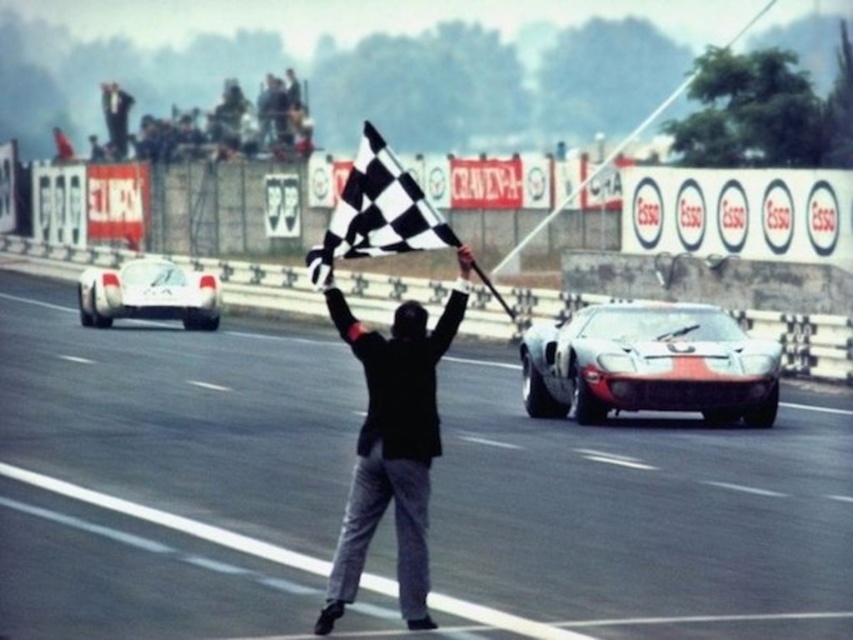
Is point (469, 506) closer to camera compared to point (340, 243)?

No, (469, 506) is further to viewer.

Where is `smooth asphalt road at center`? The width and height of the screenshot is (853, 640). smooth asphalt road at center is located at coordinates click(x=167, y=470).

Is silver metallic sports car at center closer to the viewer compared to black checkered flag at center?

No.

In the scene shown: Is silver metallic sports car at center below black checkered flag at center?

Yes, silver metallic sports car at center is below black checkered flag at center.

Does point (646, 317) lie behind point (374, 227)?

Yes, point (646, 317) is behind point (374, 227).

At what (x,y) coordinates should I click in order to perform the action: click on silver metallic sports car at center. Please return your answer as a coordinate pair (x, y). This screenshot has width=853, height=640. Looking at the image, I should click on (648, 364).

Between smooth asphalt road at center and silver metallic sports car at center, which one appears on the right side from the viewer's perspective?

From the viewer's perspective, silver metallic sports car at center appears more on the right side.

Is point (15, 624) positioned before point (723, 385)?

Yes.

Where is `smooth asphalt road at center`? smooth asphalt road at center is located at coordinates (167, 470).